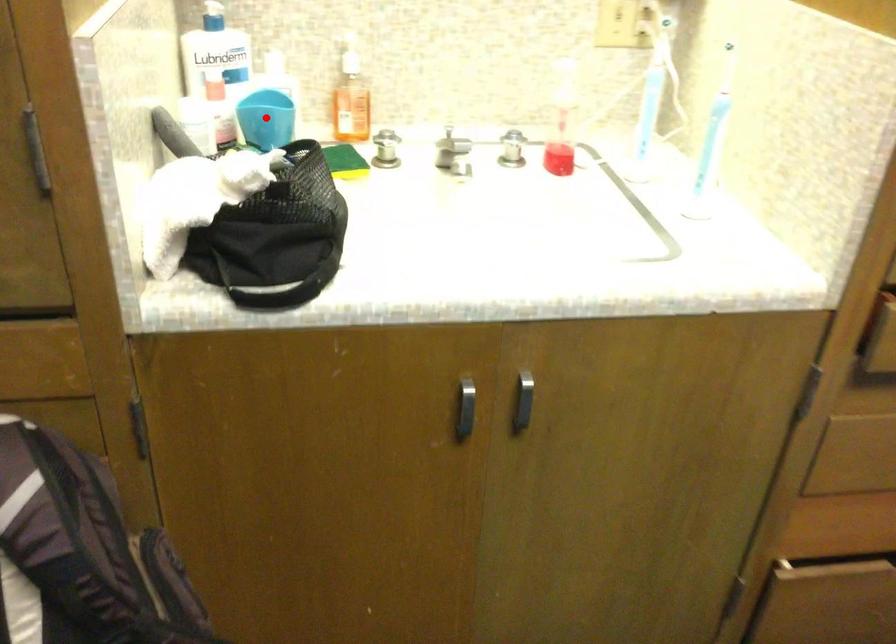
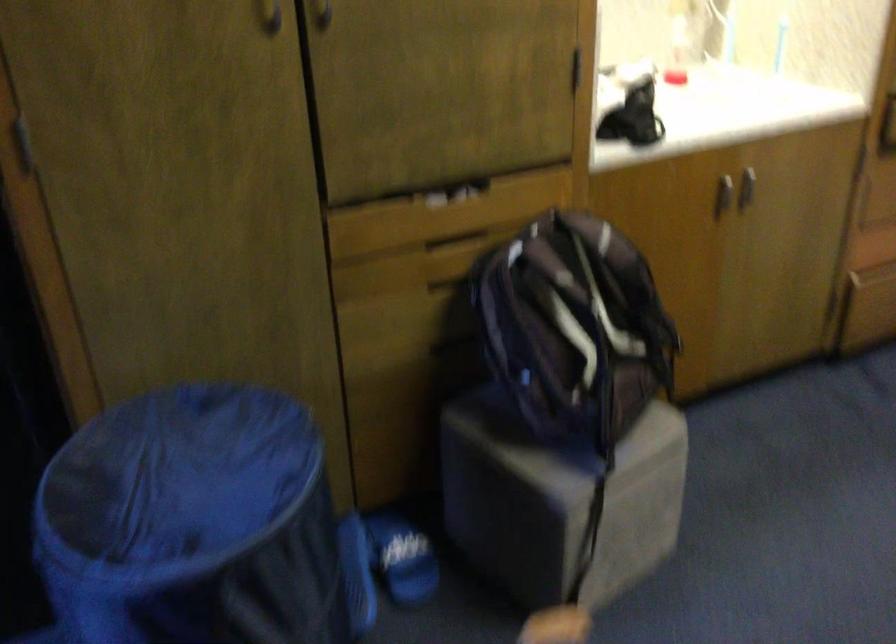
Question: I am providing you with two images of the same scene from different viewpoints. A red point is marked on the first image. At the location where the point appears in image 1, is it still visible in image 2?

Choices:
 (A) Yes
 (B) No

Answer: (B)